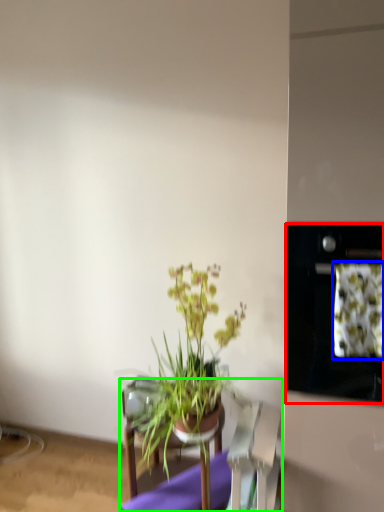
Question: Considering the real-world distances, which object is closest to oven (highlighted by a red box)? flower (highlighted by a blue box) or furniture (highlighted by a green box).

Choices:
 (A) flower
 (B) furniture

Answer: (A)